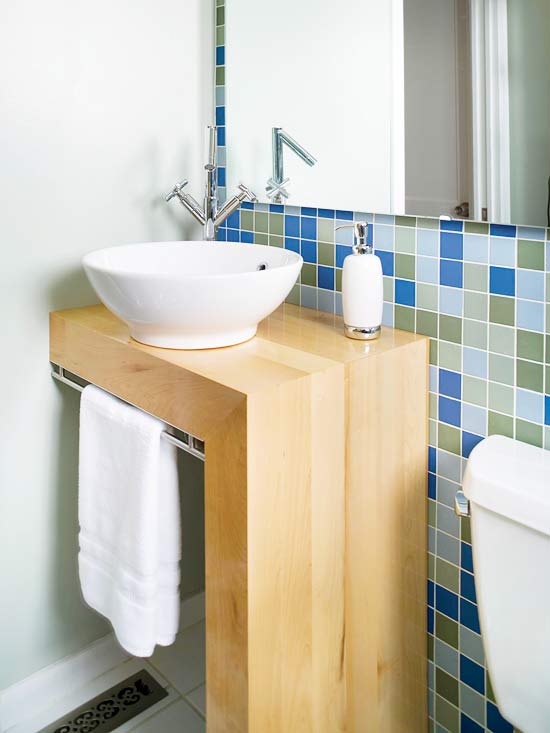
Locate an element on the screen. vent is located at coordinates (124, 706).